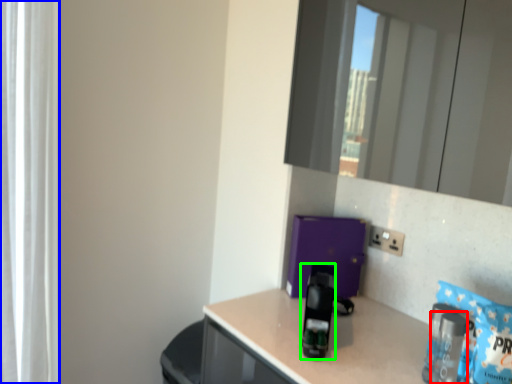
Question: Estimate the real-world distances between objects in this image. Which object is closer to bottle (highlighted by a red box), curtain (highlighted by a blue box) or appliance (highlighted by a green box)?

Choices:
 (A) curtain
 (B) appliance

Answer: (B)